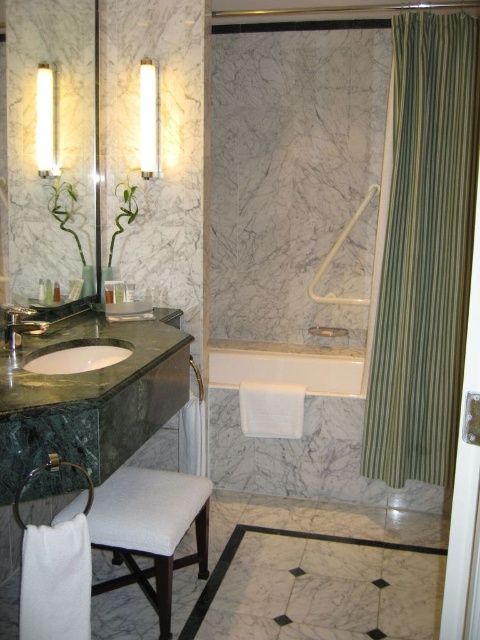
In the scene shown: Does matte glass mirror at left have a larger size compared to white fabric stool at lower left?

Correct, matte glass mirror at left is larger in size than white fabric stool at lower left.

Which is below, matte glass mirror at left or white fabric stool at lower left?

white fabric stool at lower left is lower down.

Locate an element on the screen. Image resolution: width=480 pixels, height=640 pixels. matte glass mirror at left is located at coordinates (56, 140).

Can you confirm if green marble sink at lower left is thinner than matte green marble faucet at left?

Incorrect, green marble sink at lower left's width is not less than matte green marble faucet at left's.

Does point (50, 372) come in front of point (35, 321)?

That is True.

Where is `green marble sink at lower left`? The height and width of the screenshot is (640, 480). green marble sink at lower left is located at coordinates (78, 358).

Is green striped fabric at right behind green marble sink at lower left?

Yes, green striped fabric at right is behind green marble sink at lower left.

From the picture: Is green striped fabric at right bigger than green marble sink at lower left?

Yes, green striped fabric at right is bigger than green marble sink at lower left.

Is point (377, 438) less distant than point (68, 360)?

No, (377, 438) is behind (68, 360).

Identify the location of green striped fabric at right. (424, 252).